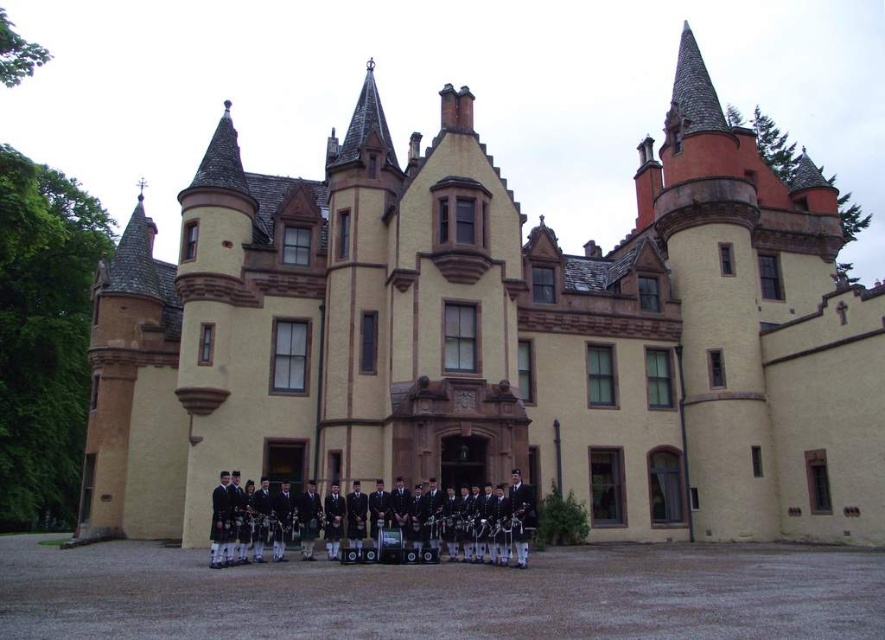
You are a photographer at the event and need to capture both the black wool kilt at center and the dark blue wool kilt at center in the same frame. Which kilt should you position on the left side of your camera viewfinder to include both?

You should position the dark blue wool kilt at center on the left side of your camera viewfinder because the black wool kilt at center is to the right of it, ensuring both are in the frame.

You are a photographer trying to capture the Scottish band members in front of the historic building. You notice two individuals wearing kilts at the center of the group. Which kilt, the black wool kilt at center or the dark blue wool kilt at center, is positioned lower in the image?

The black wool kilt at center is positioned lower in the image because it is below the dark blue wool kilt at center.

You are a photographer planning to take a group photo of the black wool kilt at center and the dark blue wool kilt at center. Since you want to ensure both kilts are fully visible, which kilt should be placed closer to the camera to avoid being blocked by the other?

The dark blue wool kilt at center should be placed closer to the camera because the black wool kilt at center is taller. Placing the shorter dark blue kilt in front will prevent it from being blocked by the taller black kilt.